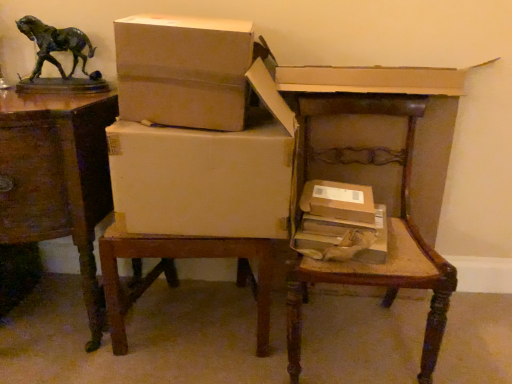
Question: Which direction should I rotate to look at brown cardboard box at center, which is counted as the 3th box, starting from the top?

Choices:
 (A) left
 (B) right

Answer: (B)

Question: Would you say bronze horse at upper left is outside white cardboard box at center, which appears as the second box when viewed from the top?

Choices:
 (A) no
 (B) yes

Answer: (B)

Question: Is bronze horse at upper left closer to camera compared to white cardboard box at center, the third box when ordered from bottom to top?

Choices:
 (A) yes
 (B) no

Answer: (B)

Question: Is bronze horse at upper left positioned behind white cardboard box at center, the third box when ordered from bottom to top?

Choices:
 (A) yes
 (B) no

Answer: (A)

Question: Is white cardboard box at center, the third box when ordered from bottom to top, located within bronze horse at upper left?

Choices:
 (A) no
 (B) yes

Answer: (A)

Question: Does bronze horse at upper left have a greater width compared to white cardboard box at center, which appears as the second box when viewed from the top?

Choices:
 (A) yes
 (B) no

Answer: (B)

Question: From the image's perspective, does bronze horse at upper left appear higher than white cardboard box at center, which appears as the second box when viewed from the top?

Choices:
 (A) yes
 (B) no

Answer: (A)

Question: Is brown cardboard box at lower right, arranged as the 1th box when ordered from the bottom, located outside wooden chair at center?

Choices:
 (A) yes
 (B) no

Answer: (B)

Question: From a real-world perspective, does brown cardboard box at lower right, the fourth box viewed from the top, sit lower than wooden chair at center?

Choices:
 (A) no
 (B) yes

Answer: (A)

Question: Is brown cardboard box at lower right, the fourth box viewed from the top, positioned in front of wooden chair at center?

Choices:
 (A) yes
 (B) no

Answer: (B)

Question: From the image's perspective, is brown cardboard box at lower right, arranged as the 1th box when ordered from the bottom, below wooden chair at center?

Choices:
 (A) no
 (B) yes

Answer: (A)

Question: Is brown cardboard box at lower right, the fourth box viewed from the top, facing towards wooden chair at center?

Choices:
 (A) no
 (B) yes

Answer: (B)

Question: Can you confirm if brown cardboard box at lower right, arranged as the 1th box when ordered from the bottom, is smaller than wooden chair at center?

Choices:
 (A) no
 (B) yes

Answer: (B)

Question: Can you confirm if white cardboard box at center, placed as the fourth box when sorted from bottom to top, is positioned to the right of wooden chair at center?

Choices:
 (A) yes
 (B) no

Answer: (B)